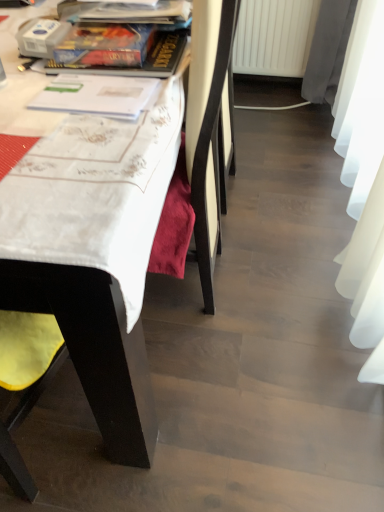
Question: Can you confirm if yellow fabric chair at left is positioned to the right of matte plastic book at upper center, arranged as the 2th book when ordered from the bottom?

Choices:
 (A) no
 (B) yes

Answer: (A)

Question: Is matte plastic book at upper center, positioned as the 2th book in front-to-back order, located within yellow fabric chair at left?

Choices:
 (A) no
 (B) yes

Answer: (A)

Question: Is the depth of yellow fabric chair at left less than that of matte plastic book at upper center, the 1th book when ordered from back to front?

Choices:
 (A) no
 (B) yes

Answer: (B)

Question: Considering the relative sizes of yellow fabric chair at left and matte plastic book at upper center, positioned as the 2th book in front-to-back order, in the image provided, is yellow fabric chair at left bigger than matte plastic book at upper center, positioned as the 2th book in front-to-back order,?

Choices:
 (A) no
 (B) yes

Answer: (B)

Question: From the image's perspective, is yellow fabric chair at left located above matte plastic book at upper center, the 1th book when ordered from back to front?

Choices:
 (A) yes
 (B) no

Answer: (B)

Question: Considering the relative sizes of yellow fabric chair at left and matte plastic book at upper center, positioned as the 2th book in front-to-back order, in the image provided, is yellow fabric chair at left shorter than matte plastic book at upper center, positioned as the 2th book in front-to-back order,?

Choices:
 (A) yes
 (B) no

Answer: (B)

Question: From the image's perspective, does yellow fabric chair at left appear lower than hardcover book at upper left, which ranks as the 1th book in front-to-back order?

Choices:
 (A) yes
 (B) no

Answer: (A)

Question: Is yellow fabric chair at left further to the viewer compared to hardcover book at upper left, which is the 2th book in back-to-front order?

Choices:
 (A) no
 (B) yes

Answer: (A)

Question: Can you confirm if yellow fabric chair at left is bigger than hardcover book at upper left, which ranks as the 1th book in bottom-to-top order?

Choices:
 (A) yes
 (B) no

Answer: (A)

Question: Is yellow fabric chair at left positioned with its back to hardcover book at upper left, which is the 2th book in back-to-front order?

Choices:
 (A) no
 (B) yes

Answer: (A)

Question: Does yellow fabric chair at left have a smaller size compared to hardcover book at upper left, which ranks as the 1th book in bottom-to-top order?

Choices:
 (A) yes
 (B) no

Answer: (B)

Question: Considering the relative sizes of yellow fabric chair at left and hardcover book at upper left, which appears as the second book when viewed from the top, in the image provided, is yellow fabric chair at left wider than hardcover book at upper left, which appears as the second book when viewed from the top,?

Choices:
 (A) yes
 (B) no

Answer: (A)

Question: Is matte plastic book at upper center, placed as the first book when sorted from top to bottom, closer to camera compared to yellow fabric chair at left?

Choices:
 (A) yes
 (B) no

Answer: (B)